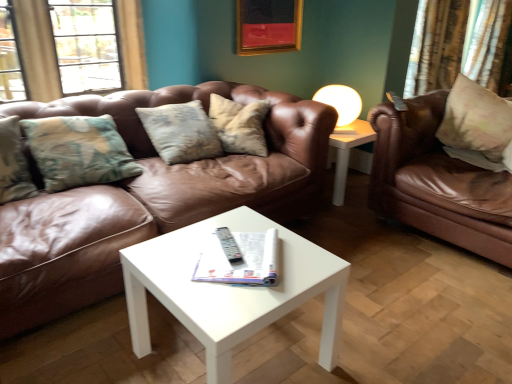
I want to click on vacant space in front of white paper magazine at center, so click(x=225, y=301).